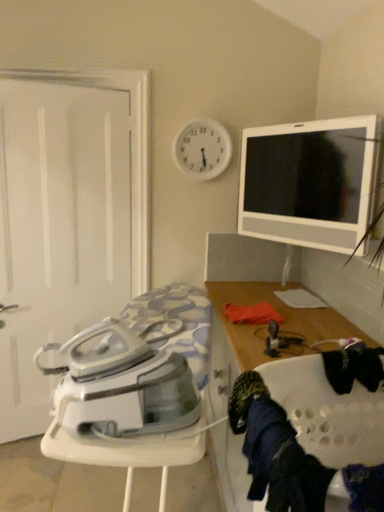
Question: Does dark blue fabric at lower right have a greater width compared to white matte door at left?

Choices:
 (A) yes
 (B) no

Answer: (B)

Question: Is dark blue fabric at lower right positioned with its back to white matte door at left?

Choices:
 (A) yes
 (B) no

Answer: (B)

Question: Does dark blue fabric at lower right lie behind white matte door at left?

Choices:
 (A) no
 (B) yes

Answer: (A)

Question: Is dark blue fabric at lower right positioned before white matte door at left?

Choices:
 (A) yes
 (B) no

Answer: (A)

Question: Can you confirm if dark blue fabric at lower right is thinner than white matte door at left?

Choices:
 (A) yes
 (B) no

Answer: (A)

Question: From a real-world perspective, does dark blue fabric at lower right sit lower than white matte door at left?

Choices:
 (A) no
 (B) yes

Answer: (B)

Question: Considering the relative sizes of white plastic clock at upper center and white glossy tv at upper right in the image provided, is white plastic clock at upper center smaller than white glossy tv at upper right?

Choices:
 (A) no
 (B) yes

Answer: (B)

Question: Does white plastic clock at upper center appear on the right side of white glossy tv at upper right?

Choices:
 (A) yes
 (B) no

Answer: (B)

Question: Is the depth of white plastic clock at upper center less than that of white glossy tv at upper right?

Choices:
 (A) yes
 (B) no

Answer: (B)

Question: Is white plastic clock at upper center at the left side of white glossy tv at upper right?

Choices:
 (A) no
 (B) yes

Answer: (B)

Question: Is white plastic clock at upper center positioned beyond the bounds of white glossy tv at upper right?

Choices:
 (A) no
 (B) yes

Answer: (B)

Question: Considering the relative sizes of white plastic clock at upper center and white glossy tv at upper right in the image provided, is white plastic clock at upper center thinner than white glossy tv at upper right?

Choices:
 (A) no
 (B) yes

Answer: (B)

Question: Is wooden cabinet at right next to white glossy tv at upper right and touching it?

Choices:
 (A) yes
 (B) no

Answer: (B)